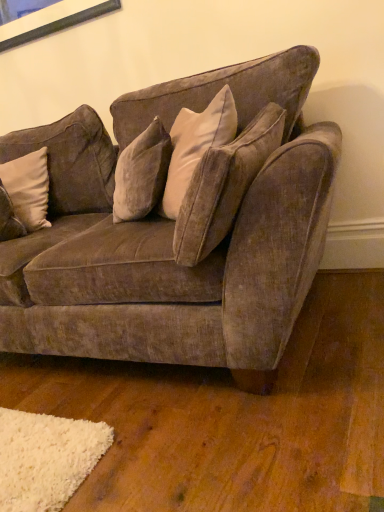
Question: Considering the positions of velvet brown couch at center and beige velvet pillow at left in the image, is velvet brown couch at center taller or shorter than beige velvet pillow at left?

Choices:
 (A) short
 (B) tall

Answer: (B)

Question: Looking at the image, does velvet brown couch at center seem bigger or smaller compared to beige velvet pillow at left?

Choices:
 (A) small
 (B) big

Answer: (B)

Question: Relative to beige velvet pillow at left, is velvet brown couch at center in front or behind?

Choices:
 (A) front
 (B) behind

Answer: (A)

Question: Considering the positions of beige velvet pillow at left and velvet brown couch at center in the image, is beige velvet pillow at left bigger or smaller than velvet brown couch at center?

Choices:
 (A) small
 (B) big

Answer: (A)

Question: From the image's perspective, is beige velvet pillow at left above or below velvet brown couch at center?

Choices:
 (A) below
 (B) above

Answer: (B)

Question: Choose the correct answer: Is beige velvet pillow at left inside velvet brown couch at center or outside it?

Choices:
 (A) inside
 (B) outside

Answer: (A)

Question: From a real-world perspective, is beige velvet pillow at left positioned above or below velvet brown couch at center?

Choices:
 (A) above
 (B) below

Answer: (A)